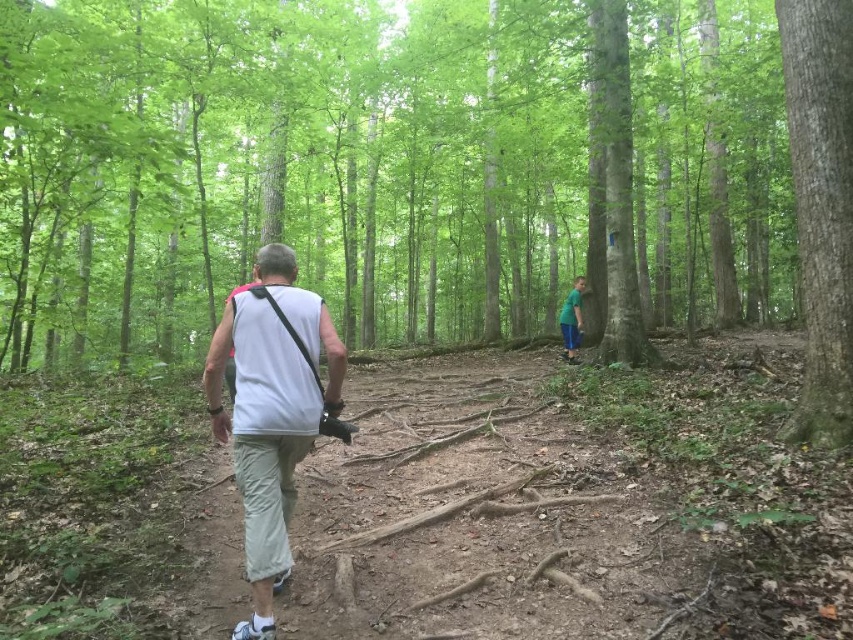
Question: Based on their relative distances, which object is farther from the smooth bark tree at center?

Choices:
 (A) green fabric shirt at center
 (B) smooth bark tree at right

Answer: (B)

Question: Does smooth bark tree at center lie behind white fabric shirt at center?

Choices:
 (A) no
 (B) yes

Answer: (B)

Question: Can you confirm if white fabric shirt at center is positioned below smooth bark tree at right?

Choices:
 (A) no
 (B) yes

Answer: (B)

Question: Which is farther from the white fabric shirt at center?

Choices:
 (A) smooth bark tree at right
 (B) smooth bark tree at center
 (C) green fabric shirt at center

Answer: (B)

Question: Which object is the closest to the green fabric shirt at center?

Choices:
 (A) smooth bark tree at right
 (B) white fabric shirt at center

Answer: (A)

Question: Is smooth bark tree at center positioned at the back of smooth bark tree at right?

Choices:
 (A) yes
 (B) no

Answer: (B)